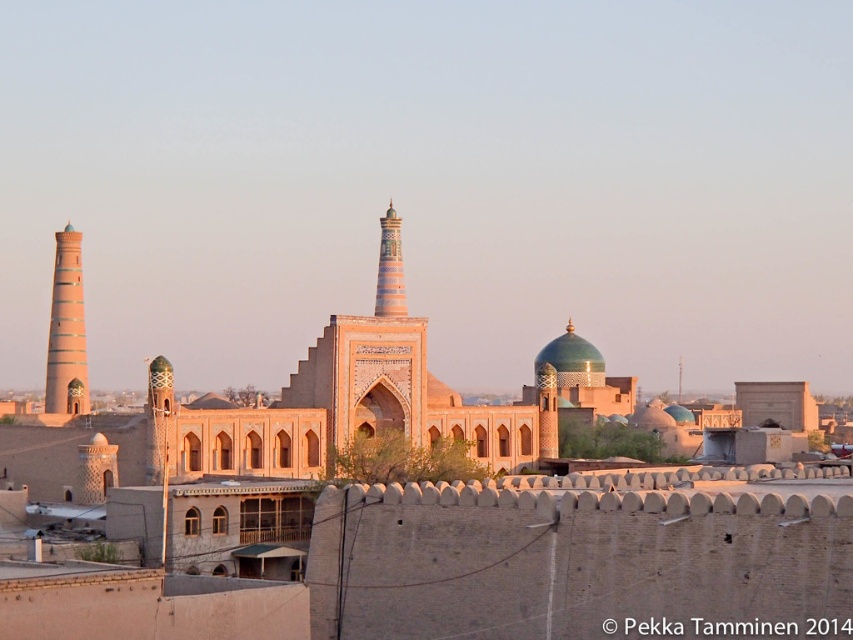
Question: Which point appears closest to the camera in this image?

Choices:
 (A) (386, 269)
 (B) (59, 257)

Answer: (B)

Question: From the image, what is the correct spatial relationship of light brown clay tower at left in relation to multicolored ceramic minaret at center?

Choices:
 (A) right
 (B) left

Answer: (B)

Question: From the image, what is the correct spatial relationship of light brown clay tower at left in relation to multicolored ceramic minaret at center?

Choices:
 (A) above
 (B) below

Answer: (B)

Question: Which of the following is the closest to the observer?

Choices:
 (A) (379, 316)
 (B) (67, 252)

Answer: (A)

Question: Is light brown clay tower at left closer to the viewer compared to multicolored ceramic minaret at center?

Choices:
 (A) no
 (B) yes

Answer: (B)